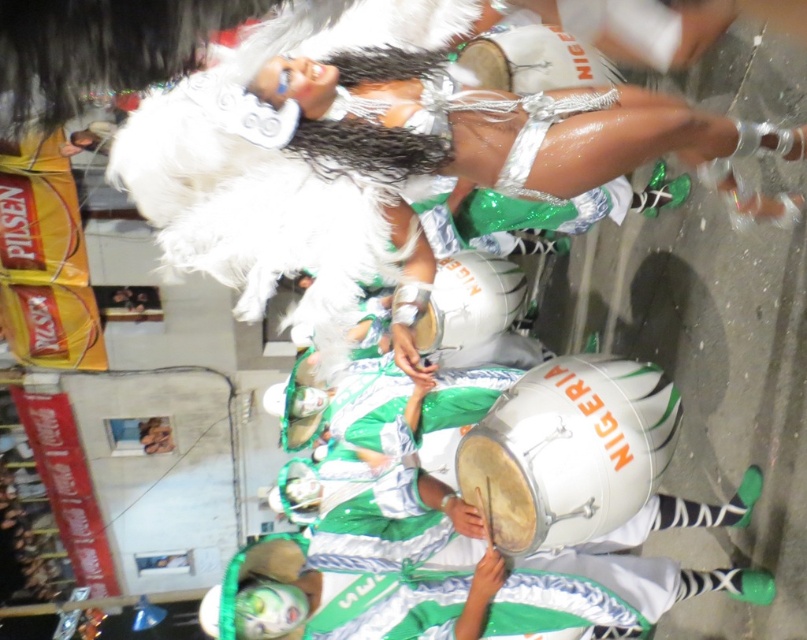
Question: Does shiny silver bikini at center appear on the left side of silver metallic drum at center?

Choices:
 (A) yes
 (B) no

Answer: (B)

Question: Can you confirm if shiny silver bikini at center is wider than silver metallic drum at center?

Choices:
 (A) no
 (B) yes

Answer: (B)

Question: Which object appears closest to the camera in this image?

Choices:
 (A) shiny silver bikini at center
 (B) silver metallic drum at center

Answer: (A)

Question: In this image, where is shiny silver bikini at center located relative to silver metallic drum at center?

Choices:
 (A) left
 (B) right

Answer: (B)

Question: Which object appears farthest from the camera in this image?

Choices:
 (A) silver metallic drum at center
 (B) shiny silver bikini at center

Answer: (A)